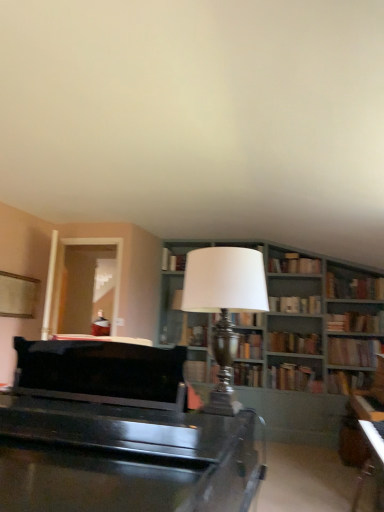
Measure the distance between clear glass door at left and camera.

They are 15.40 feet apart.

This screenshot has width=384, height=512. Describe the element at coordinates (115, 270) in the screenshot. I see `clear glass door at left` at that location.

This screenshot has height=512, width=384. Describe the element at coordinates (224, 306) in the screenshot. I see `silver metallic table lamp at center` at that location.

The height and width of the screenshot is (512, 384). Describe the element at coordinates (354, 287) in the screenshot. I see `hardcover book at upper right, the third book when ordered from top to bottom` at that location.

Measure the distance between hardcover book at center, which is the 2th book in bottom-to-top order, and camera.

19.30 feet.

Find the location of a particular element. The height and width of the screenshot is (512, 384). clear glass door at left is located at coordinates (115, 270).

From the image's perspective, who appears lower, hardcover book at center, which is the third book from bottom to top, or hardcover book at center, placed as the fourth book when sorted from top to bottom?

From the image's view, hardcover book at center, which is the third book from bottom to top, is below.

You are a GUI agent. You are given a task and a screenshot of the screen. Output one action in this format:
    pyautogui.click(x=<x>, y=<y>)
    Task: Click on the book that is the 2nd object to the left of the hardcover book at center, placed as the fourth book when sorted from top to bottom, starting at the anchor
    
    Given the screenshot: What is the action you would take?
    pyautogui.click(x=293, y=377)

From a real-world perspective, is hardcover book at center, positioned as the eleventh book in top-to-bottom order, located beneath hardcover book at center, which is the 10th book from bottom to top?

Yes, from a real-world perspective, hardcover book at center, positioned as the eleventh book in top-to-bottom order, is beneath hardcover book at center, which is the 10th book from bottom to top.

Considering the sizes of objects hardcover book at center, positioned as the eleventh book in top-to-bottom order, and hardcover book at center, placed as the fourth book when sorted from top to bottom, in the image provided, who is smaller, hardcover book at center, positioned as the eleventh book in top-to-bottom order, or hardcover book at center, placed as the fourth book when sorted from top to bottom,?

Smaller between the two is hardcover book at center, placed as the fourth book when sorted from top to bottom.

Between high-gloss black piano at center and matte brown book at center, acting as the eighth book starting from the bottom, which one appears on the right side from the viewer's perspective?

matte brown book at center, acting as the eighth book starting from the bottom, is more to the right.

How many degrees apart are the facing directions of high-gloss black piano at center and matte brown book at center, acting as the 6th book starting from the top?

176 degrees separate the facing orientations of high-gloss black piano at center and matte brown book at center, acting as the 6th book starting from the top.

Could you measure the distance between high-gloss black piano at center and matte brown book at center, acting as the 6th book starting from the top?

The distance of high-gloss black piano at center from matte brown book at center, acting as the 6th book starting from the top, is 4.61 meters.

In the scene shown: Is high-gloss black piano at center aimed at matte brown book at center, acting as the 6th book starting from the top?

Yes, high-gloss black piano at center faces towards matte brown book at center, acting as the 6th book starting from the top.

Between hardcover book at upper center, positioned as the second book in top-to-bottom order, and black glossy table at lower right, which one appears on the left side from the viewer's perspective?

From the viewer's perspective, hardcover book at upper center, positioned as the second book in top-to-bottom order, appears more on the left side.

Does point (163, 268) lie behind point (377, 487)?

Yes, it is behind point (377, 487).

Relative to black glossy table at lower right, is hardcover book at upper center, acting as the 12th book starting from the bottom, in front or behind?

hardcover book at upper center, acting as the 12th book starting from the bottom, is behind black glossy table at lower right.

Is hardcover book at upper center, acting as the 12th book starting from the bottom, facing towards black glossy table at lower right?

No, hardcover book at upper center, acting as the 12th book starting from the bottom, is not facing towards black glossy table at lower right.

Is hardcover book at right, which ranks as the 13th book in top-to-bottom order, surrounding hardcover book at center, positioned as the 9th book in top-to-bottom order?

No.

Consider the image. From the image's perspective, is hardcover book at right, the first book ordered from the bottom, located above or below hardcover book at center, positioned as the 9th book in top-to-bottom order?

hardcover book at right, the first book ordered from the bottom, is below hardcover book at center, positioned as the 9th book in top-to-bottom order.

Which object is thinner, hardcover book at right, which ranks as the 13th book in top-to-bottom order, or hardcover book at center, which ranks as the fifth book in bottom-to-top order?

Thinner between the two is hardcover book at center, which ranks as the fifth book in bottom-to-top order.

How different are the orientations of hardcover book at right, the first book ordered from the bottom, and hardcover book at center, positioned as the 9th book in top-to-bottom order, in degrees?

The angular difference between hardcover book at right, the first book ordered from the bottom, and hardcover book at center, positioned as the 9th book in top-to-bottom order, is 1.8 degrees.

Considering the positions of objects hardcover book at upper right, marked as the ninth book in a bottom-to-top arrangement, and high-gloss black piano at center in the image provided, who is in front, hardcover book at upper right, marked as the ninth book in a bottom-to-top arrangement, or high-gloss black piano at center?

high-gloss black piano at center is more forward.

Is hardcover book at upper right, marked as the ninth book in a bottom-to-top arrangement, positioned far away from high-gloss black piano at center?

Yes, hardcover book at upper right, marked as the ninth book in a bottom-to-top arrangement, is far from high-gloss black piano at center.

Is hardcover book at upper right, the 5th book from the top, aimed at high-gloss black piano at center?

Yes, hardcover book at upper right, the 5th book from the top, is oriented towards high-gloss black piano at center.

From the image's perspective, is hardcover book at upper right, marked as the ninth book in a bottom-to-top arrangement, above or below high-gloss black piano at center?

From the image's perspective, hardcover book at upper right, marked as the ninth book in a bottom-to-top arrangement, appears below high-gloss black piano at center.

From the picture: From the image's perspective, is clear glass door at left located above matte brown book at center, acting as the eighth book starting from the bottom?

Yes, from the image's perspective, clear glass door at left is on top of matte brown book at center, acting as the eighth book starting from the bottom.

Is clear glass door at left oriented towards matte brown book at center, acting as the 6th book starting from the top?

No, clear glass door at left is not oriented towards matte brown book at center, acting as the 6th book starting from the top.

Is clear glass door at left to the right of matte brown book at center, acting as the eighth book starting from the bottom, from the viewer's perspective?

No, clear glass door at left is not to the right of matte brown book at center, acting as the eighth book starting from the bottom.

Is clear glass door at left inside or outside of matte brown book at center, acting as the eighth book starting from the bottom?

clear glass door at left cannot be found inside matte brown book at center, acting as the eighth book starting from the bottom.

From a real-world perspective, which object stands above the other?

clear glass door at left is physically above.

Between clear glass door at left and hardcover book at right, which ranks as the 13th book in top-to-bottom order, which one has smaller width?

Thinner between the two is clear glass door at left.

Would you say clear glass door at left is a long distance from hardcover book at right, the first book ordered from the bottom?

Yes, clear glass door at left and hardcover book at right, the first book ordered from the bottom, are located far from each other.

Can you confirm if clear glass door at left is bigger than hardcover book at right, which ranks as the 13th book in top-to-bottom order?

Correct, clear glass door at left is larger in size than hardcover book at right, which ranks as the 13th book in top-to-bottom order.

Where is `the 7th book located beneath the hardcover book at center, which is the 10th book from bottom to top (from a real-world perspective)`? the 7th book located beneath the hardcover book at center, which is the 10th book from bottom to top (from a real-world perspective) is located at coordinates (293, 377).

Find the location of a particular element. piano in front of the matte brown book at center, acting as the eighth book starting from the bottom is located at coordinates (119, 436).

Estimate the real-world distances between objects in this image. Which object is further from hardcover book at center, which is counted as the seventh book, starting from the top, matte brown book at center, acting as the 6th book starting from the top, or hardcover book at center, the eighth book in the top-to-bottom sequence?

The object further to hardcover book at center, which is counted as the seventh book, starting from the top, is hardcover book at center, the eighth book in the top-to-bottom sequence.

Considering their positions, is clear glass door at left positioned further to matte brown book at center, acting as the 6th book starting from the top, than hardcover book at upper right, the 13th book when ordered from bottom to top?

Based on the image, clear glass door at left appears to be further to matte brown book at center, acting as the 6th book starting from the top.

Looking at the image, which one is located further to hardcover book at upper right, the 13th book when ordered from bottom to top, hardcover book at center, placed as the fourth book when sorted from top to bottom, or hardcover book at upper center, positioned as the second book in top-to-bottom order?

hardcover book at upper center, positioned as the second book in top-to-bottom order, is further to hardcover book at upper right, the 13th book when ordered from bottom to top.

When comparing their distances from hardcover book at upper right, the 13th book when ordered from bottom to top, does hardcover book at upper center, positioned as the second book in top-to-bottom order, or hardcover book at right, the first book ordered from the bottom, seem closer?

hardcover book at upper center, positioned as the second book in top-to-bottom order.

When comparing their distances from high-gloss black piano at center, does clear glass door at left or silver metallic table lamp at center seem further?

Based on the image, clear glass door at left appears to be further to high-gloss black piano at center.

From the image, which object appears to be farther from wooden bookshelf at center, hardcover book at upper right, marked as the ninth book in a bottom-to-top arrangement, or clear glass door at left?

clear glass door at left is further to wooden bookshelf at center.

Estimate the real-world distances between objects in this image. Which object is closer to black glossy table at lower right, hardcover book at right, acting as the tenth book starting from the top, or hardcover book at center, which is the 10th book from bottom to top?

The object closer to black glossy table at lower right is hardcover book at right, acting as the tenth book starting from the top.

Estimate the real-world distances between objects in this image. Which object is further from hardcover book at upper center, positioned as the second book in top-to-bottom order, hardcover book at upper right, acting as the eleventh book starting from the bottom, or hardcover book at right, acting as the tenth book starting from the top?

Based on the image, hardcover book at right, acting as the tenth book starting from the top, appears to be further to hardcover book at upper center, positioned as the second book in top-to-bottom order.

Where is `bookcase that lies between hardcover book at upper center, acting as the 12th book starting from the bottom, and hardcover book at center, which is the 2th book in bottom-to-top order, from top to bottom`? This screenshot has width=384, height=512. bookcase that lies between hardcover book at upper center, acting as the 12th book starting from the bottom, and hardcover book at center, which is the 2th book in bottom-to-top order, from top to bottom is located at coordinates (301, 326).

Locate an element on the screen. Image resolution: width=384 pixels, height=512 pixels. bookcase between matte brown book at center, acting as the eighth book starting from the bottom, and hardcover book at center, positioned as the eleventh book in top-to-bottom order, in the up-down direction is located at coordinates (301, 326).

Find the location of a particular element. bookcase between hardcover book at center, placed as the fourth book when sorted from top to bottom, and hardcover book at center, positioned as the eleventh book in top-to-bottom order, in the up-down direction is located at coordinates (301, 326).

Identify the location of table between silver metallic table lamp at center and hardcover book at center, which is the 10th book from bottom to top, along the z-axis. The image size is (384, 512). (372, 461).